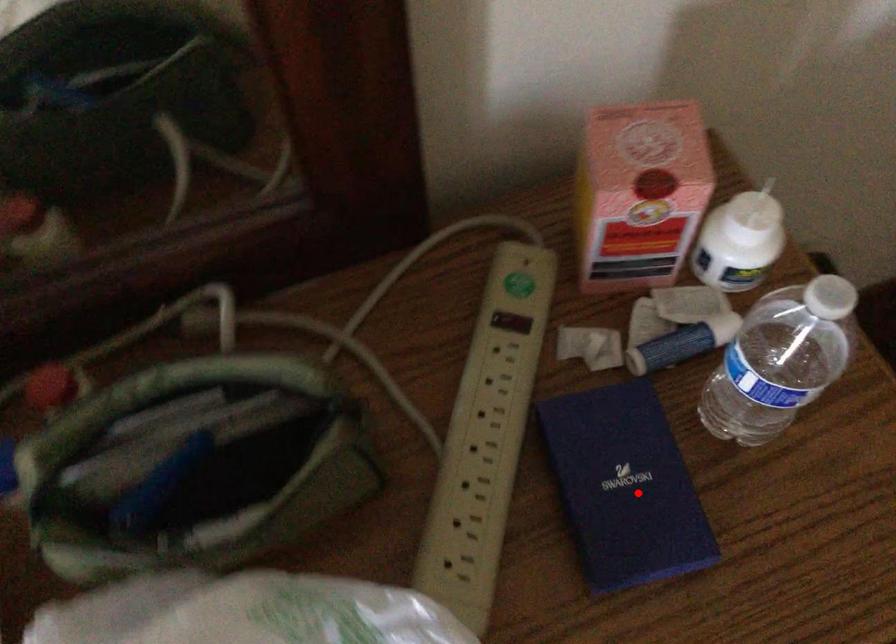
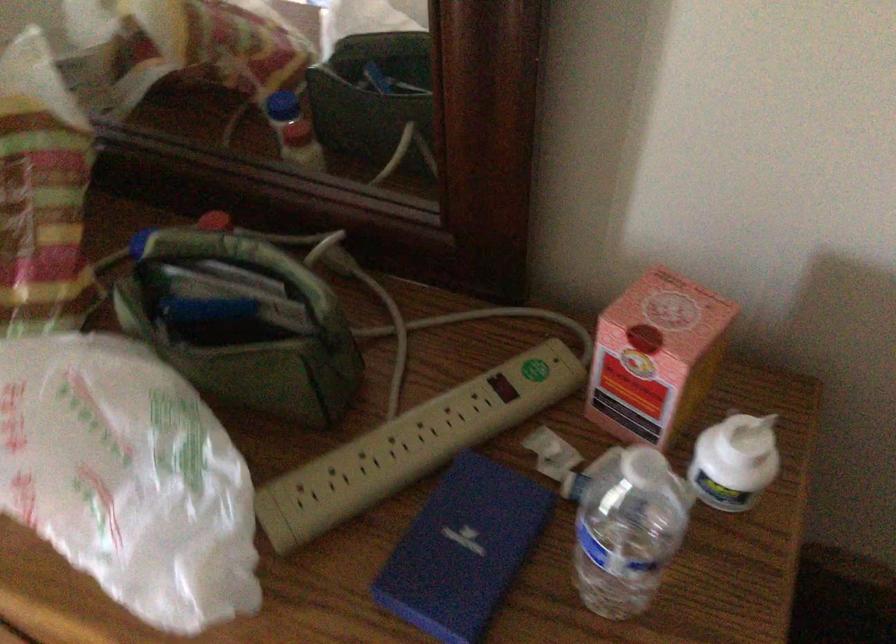
In the second image, find the point that corresponds to the highlighted location in the first image.

(462, 550)